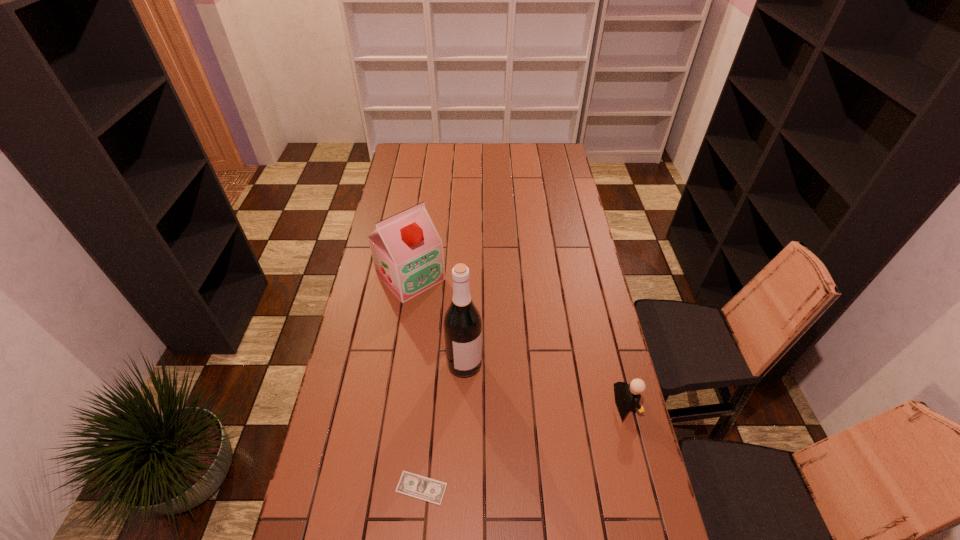
Find the location of a particular element. This screenshot has height=540, width=960. vacant space on the desktop that is between the shortest object and the second nearest object and is positioned on the label of the second farthest object is located at coordinates (506, 453).

Image resolution: width=960 pixels, height=540 pixels. I want to click on vacant space on the desktop that is between the money and the rightmost object and is positioned with the cap open on the farthest object, so click(x=561, y=431).